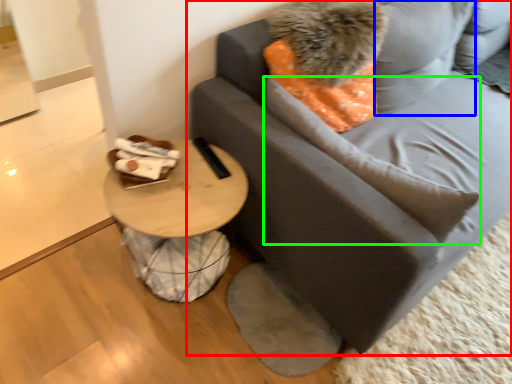
Question: Which object is the farthest from studio couch (highlighted by a red box)? Choose among these: pillow (highlighted by a blue box) or pillow (highlighted by a green box).

Choices:
 (A) pillow
 (B) pillow

Answer: (B)